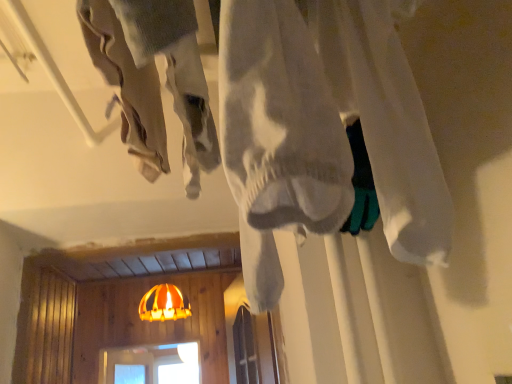
Find the location of a particular element. orange fabric lampshade at center is located at coordinates (164, 304).

What is the approximate height of orange fabric lampshade at center?

It is 31.29 centimeters.

The width and height of the screenshot is (512, 384). Describe the element at coordinates (164, 304) in the screenshot. I see `orange fabric lampshade at center` at that location.

What do you see at coordinates (128, 84) in the screenshot? The image size is (512, 384). I see `white cotton shirt at center` at bounding box center [128, 84].

Locate an element on the screen. white cotton shirt at center is located at coordinates click(x=128, y=84).

What are the coordinates of `orange fabric lampshade at center` in the screenshot? It's located at (164, 304).

Considering the positions of objects white cotton shirt at center and orange fabric lampshade at center in the image provided, who is more to the left, white cotton shirt at center or orange fabric lampshade at center?

orange fabric lampshade at center is more to the left.

Considering the positions of objects white cotton shirt at center and orange fabric lampshade at center in the image provided, who is behind, white cotton shirt at center or orange fabric lampshade at center?

orange fabric lampshade at center is behind.

Considering the points (153, 122) and (152, 315), which point is behind, point (153, 122) or point (152, 315)?

Point (152, 315)

From the image's perspective, is white cotton shirt at center above or below orange fabric lampshade at center?

white cotton shirt at center is situated higher than orange fabric lampshade at center in the image.

From a real-world perspective, is white cotton shirt at center on top of orange fabric lampshade at center?

Yes, from a real-world perspective, white cotton shirt at center is on top of orange fabric lampshade at center.

Considering the relative sizes of white cotton shirt at center and orange fabric lampshade at center in the image provided, is white cotton shirt at center thinner than orange fabric lampshade at center?

Yes.

Does white cotton shirt at center have a greater height compared to orange fabric lampshade at center?

Yes, white cotton shirt at center is taller than orange fabric lampshade at center.

Looking at this image, which of these two, white cotton shirt at center or orange fabric lampshade at center, is bigger?

orange fabric lampshade at center.

Would you say white cotton shirt at center is outside orange fabric lampshade at center?

That's correct, white cotton shirt at center is outside of orange fabric lampshade at center.

Is white cotton shirt at center far from orange fabric lampshade at center?

Yes, white cotton shirt at center and orange fabric lampshade at center are located far from each other.

Could you tell me if white cotton shirt at center is facing orange fabric lampshade at center?

No, white cotton shirt at center is not turned towards orange fabric lampshade at center.

Identify the location of lamp located on the left of white cotton shirt at center. (164, 304).

In the image, is orange fabric lampshade at center on the left side or the right side of white cotton shirt at center?

orange fabric lampshade at center is positioned on white cotton shirt at center's left side.

Which object is more forward, orange fabric lampshade at center or white cotton shirt at center?

white cotton shirt at center.

Is point (184, 301) farther from viewer compared to point (193, 57)?

Yes.

Consider the image. From the image's perspective, which object appears higher, orange fabric lampshade at center or white cotton shirt at center?

white cotton shirt at center appears higher in the image.

From a real-world perspective, is orange fabric lampshade at center positioned above or below white cotton shirt at center?

Clearly, from a real-world perspective, orange fabric lampshade at center is below white cotton shirt at center.

Considering the sizes of objects orange fabric lampshade at center and white cotton shirt at center in the image provided, who is thinner, orange fabric lampshade at center or white cotton shirt at center?

Thinner between the two is white cotton shirt at center.

From their relative heights in the image, would you say orange fabric lampshade at center is taller or shorter than white cotton shirt at center?

Clearly, orange fabric lampshade at center is shorter compared to white cotton shirt at center.

Does orange fabric lampshade at center have a smaller size compared to white cotton shirt at center?

Actually, orange fabric lampshade at center might be larger than white cotton shirt at center.

Is orange fabric lampshade at center outside of white cotton shirt at center?

Absolutely, orange fabric lampshade at center is external to white cotton shirt at center.

Is orange fabric lampshade at center not close to white cotton shirt at center?

orange fabric lampshade at center is positioned a significant distance from white cotton shirt at center.

Could you tell me if orange fabric lampshade at center is facing white cotton shirt at center?

Yes.

Locate an element on the screen. lamp that is under the white cotton shirt at center (from a real-world perspective) is located at coordinates click(x=164, y=304).

Identify the location of clothing located above the orange fabric lampshade at center (from the image's perspective). (128, 84).

This screenshot has width=512, height=384. What are the coordinates of `lamp behind the white cotton shirt at center` in the screenshot? It's located at point(164,304).